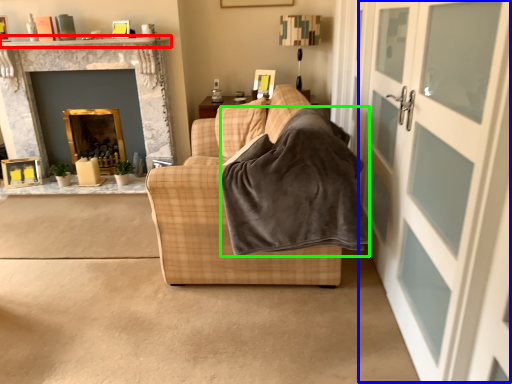
Question: Considering the real-world distances, which object is closest to mantle (highlighted by a red box)? screen door (highlighted by a blue box) or blanket (highlighted by a green box).

Choices:
 (A) screen door
 (B) blanket

Answer: (B)